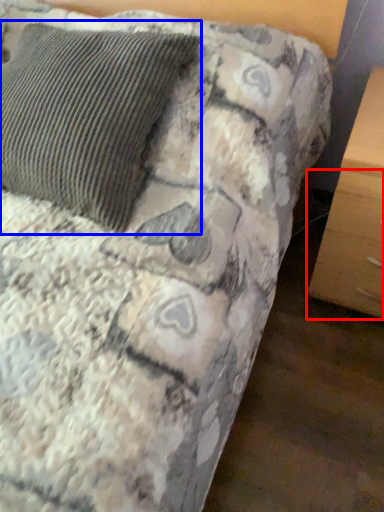
Question: Which of the following is the closest to the observer, drawer (highlighted by a red box) or pillow (highlighted by a blue box)?

Choices:
 (A) drawer
 (B) pillow

Answer: (B)